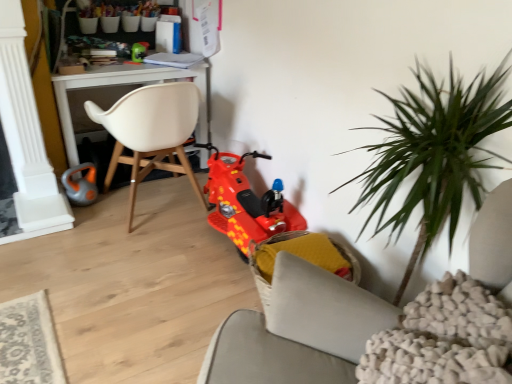
Image resolution: width=512 pixels, height=384 pixels. What are the coordinates of `free space between orange rubber toy at lower left, placed as the 2th toy when sorted from top to bottom, and shiny plastic scooter at center, which appears as the 3th toy when viewed from the top` in the screenshot? It's located at (164, 220).